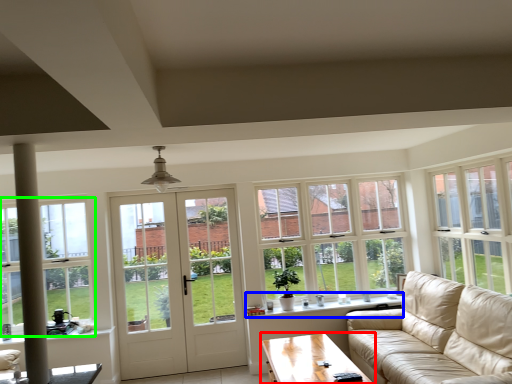
Question: Based on their relative distances, which object is nearer to coffee table (highlighted by a red box)? Choose from window sill (highlighted by a blue box) and window (highlighted by a green box).

Choices:
 (A) window sill
 (B) window

Answer: (A)